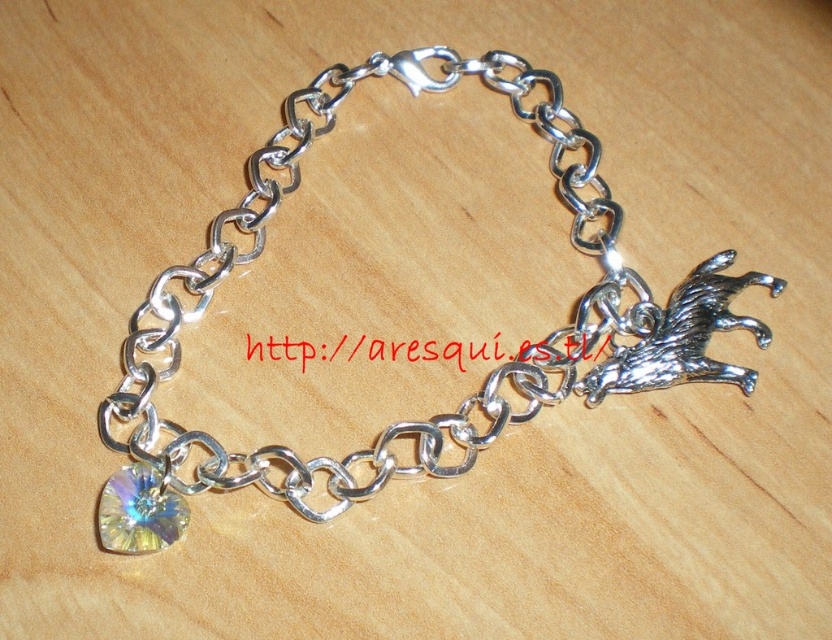
Question: Which of the following is the closest to the observer?

Choices:
 (A) pos(312,472)
 (B) pos(100,509)

Answer: (B)

Question: Is silver metallic chain at center bigger than rainbow crystal charm at bottom left?

Choices:
 (A) yes
 (B) no

Answer: (A)

Question: Does silver metallic chain at center have a smaller size compared to rainbow crystal charm at bottom left?

Choices:
 (A) no
 (B) yes

Answer: (A)

Question: Which point is closer to the camera?

Choices:
 (A) silver metallic chain at center
 (B) rainbow crystal charm at bottom left

Answer: (B)

Question: Does silver metallic chain at center have a smaller size compared to rainbow crystal charm at bottom left?

Choices:
 (A) no
 (B) yes

Answer: (A)

Question: Which of the following is the farthest from the observer?

Choices:
 (A) silver metallic chain at center
 (B) rainbow crystal charm at bottom left

Answer: (A)